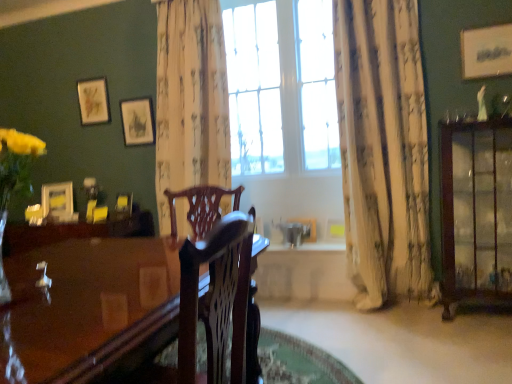
Where is `vacant area situated below brown wood cabinet at right (from a real-world perspective)`? The image size is (512, 384). vacant area situated below brown wood cabinet at right (from a real-world perspective) is located at coordinates [482, 317].